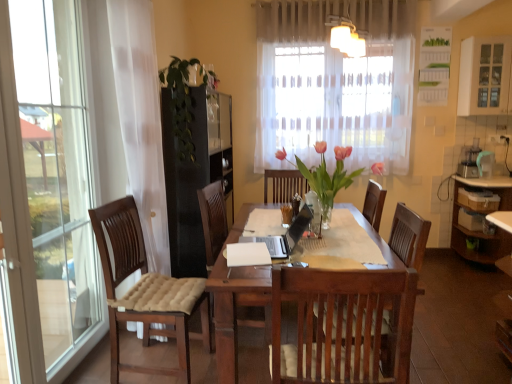
Question: From the image's perspective, is translucent glass vase at center, the first floral arrangement positioned from the right, positioned above or below white glass cabinet at upper right?

Choices:
 (A) above
 (B) below

Answer: (B)

Question: In the image, is translucent glass vase at center, acting as the first floral arrangement starting from the front, on the left side or the right side of white glass cabinet at upper right?

Choices:
 (A) left
 (B) right

Answer: (A)

Question: Which object is positioned closest to the white glass cabinet at upper right?

Choices:
 (A) green leafy plant at center, which is the second floral arrangement in front-to-back order
 (B) translucent glass vase at center, acting as the first floral arrangement starting from the front

Answer: (B)

Question: Which of these objects is positioned farthest from the translucent glass vase at center, acting as the first floral arrangement starting from the front?

Choices:
 (A) green leafy plant at center, the first floral arrangement positioned from the back
 (B) white glass cabinet at upper right

Answer: (B)